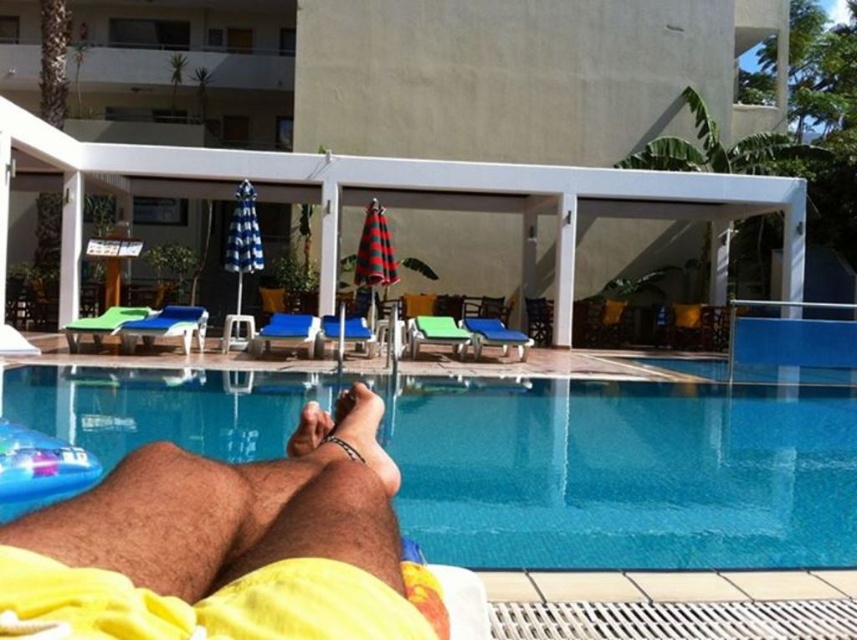
Question: Estimate the real-world distances between objects in this image. Which object is farther from the blue glossy water at center?

Choices:
 (A) white plastic patio at center
 (B) smooth skin foot at lower center

Answer: (A)

Question: Does yellow fabric at lower center have a larger size compared to smooth skin foot at lower center?

Choices:
 (A) no
 (B) yes

Answer: (B)

Question: Does yellow fabric at lower center appear over smooth skin foot at lower center?

Choices:
 (A) no
 (B) yes

Answer: (A)

Question: Which point appears farthest from the camera in this image?

Choices:
 (A) pyautogui.click(x=300, y=454)
 (B) pyautogui.click(x=417, y=204)
 (C) pyautogui.click(x=831, y=433)

Answer: (B)

Question: Which object appears closest to the camera in this image?

Choices:
 (A) smooth skin foot at lower center
 (B) white plastic patio at center
 (C) yellow fabric at lower center

Answer: (C)

Question: Can you confirm if blue glossy water at center is wider than yellow fabric at lower center?

Choices:
 (A) yes
 (B) no

Answer: (A)